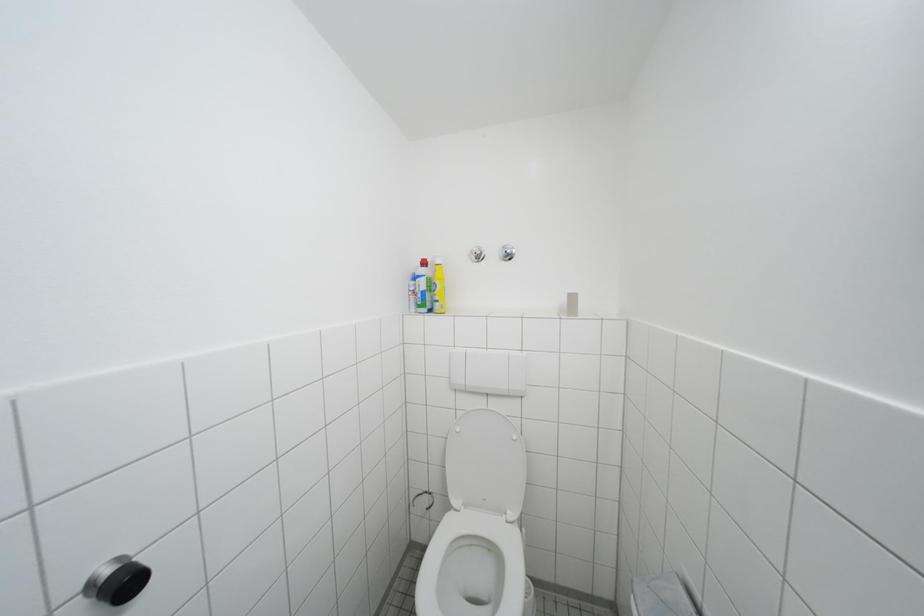
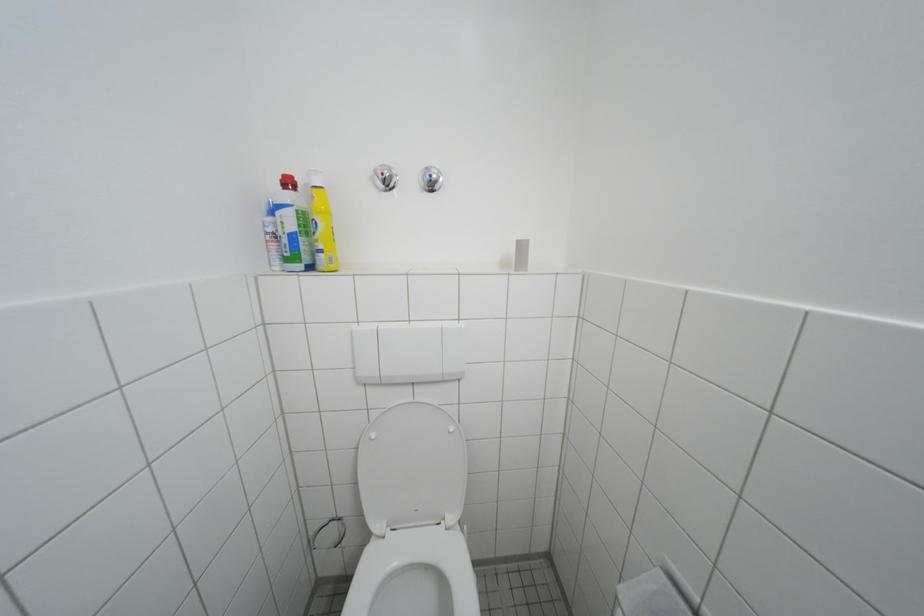
Question: Which direction would the cameraman need to move to produce the second image? Reply with the corresponding letter.

Choices:
 (A) Left
 (B) Right
 (C) Forward
 (D) Backward

Answer: (C)